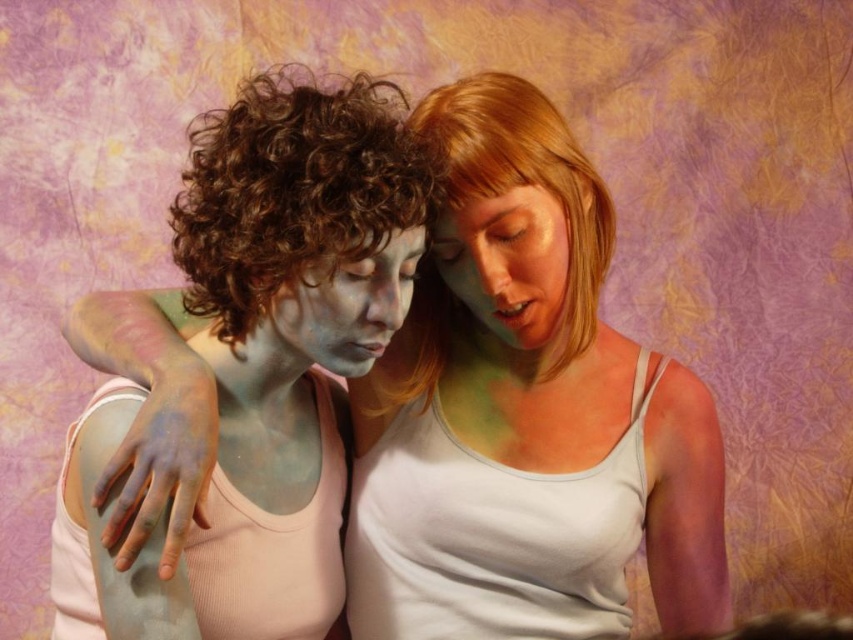
Question: Which object is positioned farthest from the matte painted face at center?

Choices:
 (A) green matte face at center
 (B) matte paint face at center

Answer: (B)

Question: Among these points, which one is nearest to the camera?

Choices:
 (A) (268, 332)
 (B) (686, 417)

Answer: (A)

Question: Can you confirm if matte painted face at center is positioned below green matte face at center?

Choices:
 (A) no
 (B) yes

Answer: (B)

Question: From the image, what is the correct spatial relationship of matte painted face at center in relation to green matte face at center?

Choices:
 (A) right
 (B) left

Answer: (B)

Question: Which object appears farthest from the camera in this image?

Choices:
 (A) matte paint face at center
 (B) matte painted face at center

Answer: (A)

Question: Is green matte face at center bigger than matte paint face at center?

Choices:
 (A) no
 (B) yes

Answer: (A)